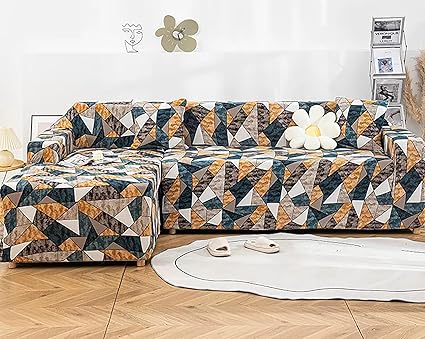
Locate an element on the screen. The image size is (425, 339). house shoes is located at coordinates (221, 245), (267, 242).